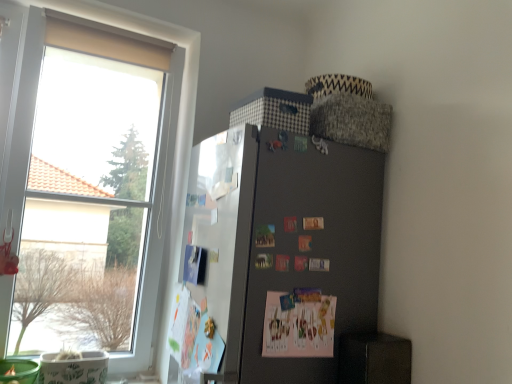
Question: From a real-world perspective, does transparent glass window at left sit lower than satin black fridge at upper right?

Choices:
 (A) no
 (B) yes

Answer: (A)

Question: Does transparent glass window at left appear on the left side of satin black fridge at upper right?

Choices:
 (A) yes
 (B) no

Answer: (A)

Question: Considering the relative sizes of transparent glass window at left and satin black fridge at upper right in the image provided, is transparent glass window at left smaller than satin black fridge at upper right?

Choices:
 (A) no
 (B) yes

Answer: (B)

Question: Is satin black fridge at upper right a part of transparent glass window at left?

Choices:
 (A) yes
 (B) no

Answer: (B)

Question: Is transparent glass window at left wider than satin black fridge at upper right?

Choices:
 (A) yes
 (B) no

Answer: (B)

Question: From a real-world perspective, is transparent glass window at left positioned above or below pink paper postcard at center?

Choices:
 (A) below
 (B) above

Answer: (B)

Question: From the image's perspective, is transparent glass window at left positioned above or below pink paper postcard at center?

Choices:
 (A) below
 (B) above

Answer: (B)

Question: Is transparent glass window at left wider or thinner than pink paper postcard at center?

Choices:
 (A) wide
 (B) thin

Answer: (A)

Question: Does point (142, 155) appear closer or farther from the camera than point (331, 327)?

Choices:
 (A) closer
 (B) farther

Answer: (B)

Question: From the image's perspective, is white paperboard at left above or below satin black fridge at upper right?

Choices:
 (A) below
 (B) above

Answer: (B)

Question: Is white paperboard at left wider or thinner than satin black fridge at upper right?

Choices:
 (A) thin
 (B) wide

Answer: (A)

Question: From a real-world perspective, is white paperboard at left positioned above or below satin black fridge at upper right?

Choices:
 (A) above
 (B) below

Answer: (A)

Question: Is point (202, 339) positioned closer to the camera than point (372, 251)?

Choices:
 (A) farther
 (B) closer

Answer: (B)

Question: In terms of height, does white paperboard at left look taller or shorter compared to transparent glass window at left?

Choices:
 (A) short
 (B) tall

Answer: (A)

Question: Is white paperboard at left spatially inside transparent glass window at left, or outside of it?

Choices:
 (A) inside
 (B) outside

Answer: (B)